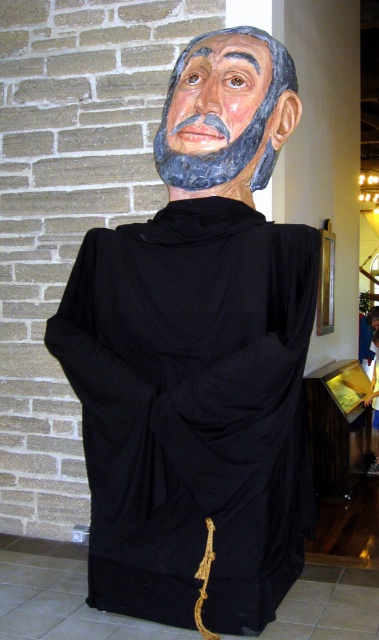
You are an art curator planning to display the matte black statue at center and the matte black mask at upper center in a gallery. The gallery has a narrow corridor that can only accommodate items with a maximum width of 1.2 meters. Based on their sizes, which item should you prioritize placing in the corridor to ensure it fits?

The matte black mask at upper center should be prioritized because its width is smaller than the matte black statue at center, ensuring it will fit within the 1.2 meter width limit of the corridor.

You are standing in front of the life sized figure dressed in a black robe. You want to take a photo of the figure from a distance that ensures the entire figure fits in the frame. The camera you are using has a field of view that can capture objects up to 3 meters away. Will the point at coordinates point (167, 365) be within the camera frame?

The point at coordinates point (167, 365) is 2.89 meters away from the camera, which is within the camera frame since it is less than 3 meters.